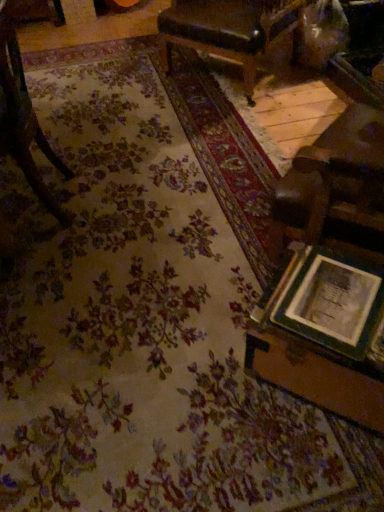
The width and height of the screenshot is (384, 512). Describe the element at coordinates (323, 334) in the screenshot. I see `wooden table at lower right` at that location.

Locate an element on the screen. This screenshot has height=512, width=384. wooden table at lower right is located at coordinates click(x=323, y=334).

Is wooden chair at left, which is the 1th chair in bottom-to-top order, not within leather-like brown chair at upper center, acting as the 1th chair starting from the top?

Yes, wooden chair at left, which is the 1th chair in bottom-to-top order, is not within leather-like brown chair at upper center, acting as the 1th chair starting from the top.

Can you confirm if wooden chair at left, marked as the second chair in a back-to-front arrangement, is positioned to the right of leather-like brown chair at upper center, which is the 1th chair from back to front?

In fact, wooden chair at left, marked as the second chair in a back-to-front arrangement, is to the left of leather-like brown chair at upper center, which is the 1th chair from back to front.

Are wooden chair at left, marked as the 2th chair in a right-to-left arrangement, and leather-like brown chair at upper center, positioned as the 2th chair in left-to-right order, far apart?

Yes, wooden chair at left, marked as the 2th chair in a right-to-left arrangement, and leather-like brown chair at upper center, positioned as the 2th chair in left-to-right order, are located far from each other.

Is leather-like brown chair at upper center, positioned as the 1th chair in right-to-left order, wider or thinner than wooden picture frame at lower right?

Clearly, leather-like brown chair at upper center, positioned as the 1th chair in right-to-left order, has more width compared to wooden picture frame at lower right.

Based on the photo, considering the relative sizes of leather-like brown chair at upper center, marked as the second chair in a bottom-to-top arrangement, and wooden picture frame at lower right in the image provided, is leather-like brown chair at upper center, marked as the second chair in a bottom-to-top arrangement, smaller than wooden picture frame at lower right?

→ No, leather-like brown chair at upper center, marked as the second chair in a bottom-to-top arrangement, is not smaller than wooden picture frame at lower right.

Is leather-like brown chair at upper center, which is the 1th chair from back to front, positioned in front of wooden picture frame at lower right?

That is False.

Considering the relative positions of leather-like brown chair at upper center, marked as the second chair in a bottom-to-top arrangement, and wooden picture frame at lower right in the image provided, is leather-like brown chair at upper center, marked as the second chair in a bottom-to-top arrangement, to the right of wooden picture frame at lower right from the viewer's perspective?

No, leather-like brown chair at upper center, marked as the second chair in a bottom-to-top arrangement, is not to the right of wooden picture frame at lower right.

How much distance is there between wooden chair at left, marked as the second chair in a back-to-front arrangement, and wooden picture frame at lower right?

1.17 meters.

Find the location of a particular element. chair above the wooden picture frame at lower right (from a real-world perspective) is located at coordinates (23, 120).

Is point (10, 76) closer or farther from the camera than point (364, 349)?

Point (10, 76) is farther from the camera than point (364, 349).

Is wooden chair at left, marked as the first chair in a front-to-back arrangement, positioned with its back to wooden picture frame at lower right?

wooden chair at left, marked as the first chair in a front-to-back arrangement, is not turned away from wooden picture frame at lower right.

Which point is more forward, (x=347, y=267) or (x=36, y=123)?

The point (x=347, y=267) is closer to the camera.

Can you confirm if wooden table at lower right is positioned to the right of wooden chair at left, marked as the 2th chair in a right-to-left arrangement?

Indeed, wooden table at lower right is positioned on the right side of wooden chair at left, marked as the 2th chair in a right-to-left arrangement.

Considering the sizes of objects wooden table at lower right and wooden chair at left, marked as the 2th chair in a right-to-left arrangement, in the image provided, who is shorter, wooden table at lower right or wooden chair at left, marked as the 2th chair in a right-to-left arrangement,?

wooden table at lower right.

What's the angular difference between wooden table at lower right and wooden chair at left, the 1th chair in the left-to-right sequence,'s facing directions?

The facing directions of wooden table at lower right and wooden chair at left, the 1th chair in the left-to-right sequence, are 38.1 degrees apart.

Does point (378, 271) come behind point (8, 130)?

That is False.

Who is taller, wooden picture frame at lower right or wooden chair at left, the 1th chair in the left-to-right sequence?

wooden chair at left, the 1th chair in the left-to-right sequence.

Based on the photo, looking at the image, does wooden picture frame at lower right seem bigger or smaller compared to wooden chair at left, the 2th chair in the top-to-bottom sequence?

Considering their sizes, wooden picture frame at lower right takes up less space than wooden chair at left, the 2th chair in the top-to-bottom sequence.

Which object is closer to the camera taking this photo, wooden picture frame at lower right or leather-like brown chair at upper center, positioned as the 2th chair in left-to-right order?

Positioned in front is wooden picture frame at lower right.

Is wooden picture frame at lower right placed right next to leather-like brown chair at upper center, which is the 1th chair from back to front?

They are not placed beside each other.

Visually, is wooden picture frame at lower right positioned to the left or to the right of leather-like brown chair at upper center, marked as the second chair in a bottom-to-top arrangement?

Clearly, wooden picture frame at lower right is on the right of leather-like brown chair at upper center, marked as the second chair in a bottom-to-top arrangement, in the image.

Considering the sizes of wooden picture frame at lower right and leather-like brown chair at upper center, positioned as the 2th chair in left-to-right order, in the image, is wooden picture frame at lower right taller or shorter than leather-like brown chair at upper center, positioned as the 2th chair in left-to-right order,?

Considering their sizes, wooden picture frame at lower right has less height than leather-like brown chair at upper center, positioned as the 2th chair in left-to-right order.

Can you tell me how much leather-like brown chair at upper center, marked as the second chair in a bottom-to-top arrangement, and wooden chair at left, the 1th chair in the left-to-right sequence, differ in facing direction?

41.5 degrees separate the facing orientations of leather-like brown chair at upper center, marked as the second chair in a bottom-to-top arrangement, and wooden chair at left, the 1th chair in the left-to-right sequence.

Are leather-like brown chair at upper center, marked as the second chair in a bottom-to-top arrangement, and wooden chair at left, marked as the 2th chair in a right-to-left arrangement, beside each other?

There is a gap between leather-like brown chair at upper center, marked as the second chair in a bottom-to-top arrangement, and wooden chair at left, marked as the 2th chair in a right-to-left arrangement.

Visually, is leather-like brown chair at upper center, positioned as the 1th chair in right-to-left order, positioned to the left or to the right of wooden chair at left, marked as the second chair in a back-to-front arrangement?

Clearly, leather-like brown chair at upper center, positioned as the 1th chair in right-to-left order, is on the right of wooden chair at left, marked as the second chair in a back-to-front arrangement, in the image.

From the image's perspective, would you say leather-like brown chair at upper center, positioned as the 1th chair in right-to-left order, is shown under wooden chair at left, marked as the first chair in a front-to-back arrangement?

No, from the image's perspective, leather-like brown chair at upper center, positioned as the 1th chair in right-to-left order, is not beneath wooden chair at left, marked as the first chair in a front-to-back arrangement.

Where is `chair lying on the left of leather-like brown chair at upper center, marked as the second chair in a bottom-to-top arrangement`? The image size is (384, 512). chair lying on the left of leather-like brown chair at upper center, marked as the second chair in a bottom-to-top arrangement is located at coordinates (23, 120).

Identify the location of picture frame that appears below the leather-like brown chair at upper center, which is the 1th chair from back to front (from the image's perspective). (334, 304).

Which object lies nearer to the anchor point wooden table at lower right, wooden chair at left, the 2th chair in the top-to-bottom sequence, or leather-like brown chair at upper center, acting as the 1th chair starting from the top?

wooden chair at left, the 2th chair in the top-to-bottom sequence, is closer to wooden table at lower right.

In the scene shown: Estimate the real-world distances between objects in this image. Which object is closer to wooden table at lower right, wooden chair at left, the 1th chair in the left-to-right sequence, or wooden picture frame at lower right?

wooden picture frame at lower right.

Which object lies further to the anchor point wooden picture frame at lower right, leather-like brown chair at upper center, positioned as the 1th chair in right-to-left order, or wooden chair at left, the 1th chair in the left-to-right sequence?

leather-like brown chair at upper center, positioned as the 1th chair in right-to-left order, is further to wooden picture frame at lower right.

Looking at the image, which one is located further to leather-like brown chair at upper center, positioned as the 1th chair in right-to-left order, wooden picture frame at lower right or wooden table at lower right?

The object further to leather-like brown chair at upper center, positioned as the 1th chair in right-to-left order, is wooden picture frame at lower right.

Looking at the image, which one is located closer to leather-like brown chair at upper center, which is the 1th chair from back to front, wooden chair at left, which is the 1th chair in bottom-to-top order, or wooden picture frame at lower right?

wooden chair at left, which is the 1th chair in bottom-to-top order.

Looking at the image, which one is located closer to wooden chair at left, marked as the second chair in a back-to-front arrangement, wooden table at lower right or wooden picture frame at lower right?

wooden table at lower right is closer to wooden chair at left, marked as the second chair in a back-to-front arrangement.

From the image, which object appears to be farther from wooden picture frame at lower right, wooden chair at left, the 1th chair in the left-to-right sequence, or wooden table at lower right?

wooden chair at left, the 1th chair in the left-to-right sequence, is further to wooden picture frame at lower right.

Considering their positions, is wooden table at lower right positioned closer to wooden picture frame at lower right than wooden chair at left, which is the 1th chair in bottom-to-top order?

The object closer to wooden picture frame at lower right is wooden table at lower right.

I want to click on picture frame that lies between leather-like brown chair at upper center, positioned as the 2th chair in left-to-right order, and wooden table at lower right from top to bottom, so click(x=334, y=304).

Identify the location of chair between leather-like brown chair at upper center, which is the 1th chair from back to front, and wooden picture frame at lower right, in the vertical direction. (23, 120).

Locate an element on the screen. This screenshot has width=384, height=512. picture frame between wooden chair at left, marked as the second chair in a back-to-front arrangement, and wooden table at lower right, in the horizontal direction is located at coordinates (334, 304).

Identify the location of chair between leather-like brown chair at upper center, positioned as the 1th chair in right-to-left order, and wooden table at lower right vertically. (23, 120).